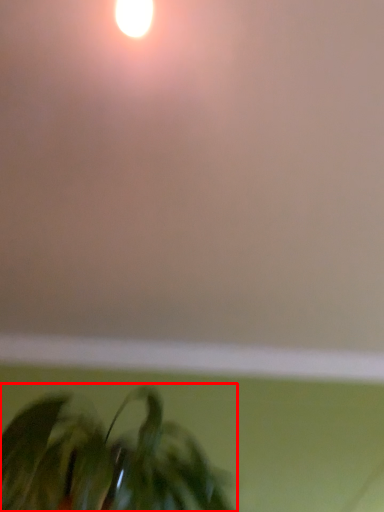
Question: From the image's perspective, where is houseplant (annotated by the red box) located relative to backdrop?

Choices:
 (A) above
 (B) below

Answer: (B)